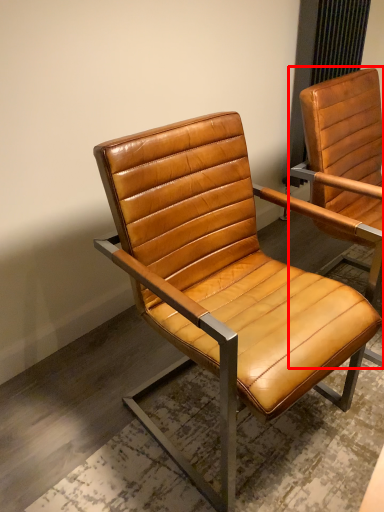
Question: Where is chair (annotated by the red box) located in relation to chair in the image?

Choices:
 (A) left
 (B) right

Answer: (B)